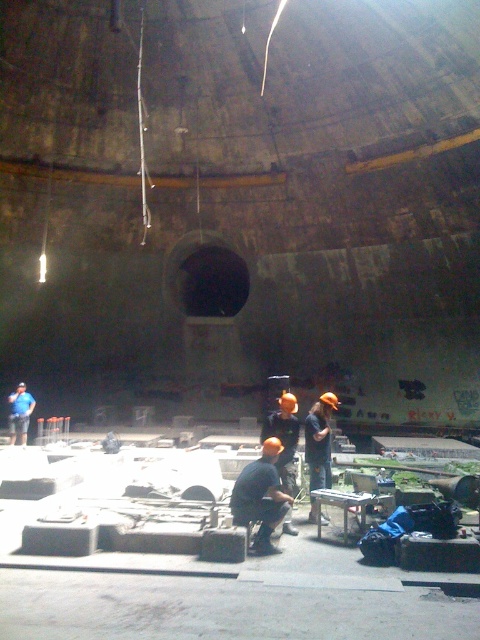
Can you confirm if matte gray concrete blocks at center is positioned above matte orange hard hat at center?

No.

Does matte gray concrete blocks at center have a greater height compared to matte orange hard hat at center?

No, matte gray concrete blocks at center is not taller than matte orange hard hat at center.

Locate an element on the screen. The width and height of the screenshot is (480, 640). matte gray concrete blocks at center is located at coordinates (224, 595).

At what (x,y) coordinates should I click in order to perform the action: click on matte gray concrete blocks at center. Please return your answer as a coordinate pair (x, y). Looking at the image, I should click on (224, 595).

Is point (319, 404) less distant than point (20, 413)?

Yes, it is.

Between orange hard hat at center and matte blue shirt at lower left, which one has more height?

Standing taller between the two is matte blue shirt at lower left.

Who is more forward, (317, 420) or (21, 433)?

Point (317, 420) is more forward.

This screenshot has height=640, width=480. I want to click on orange hard hat at center, so click(320, 440).